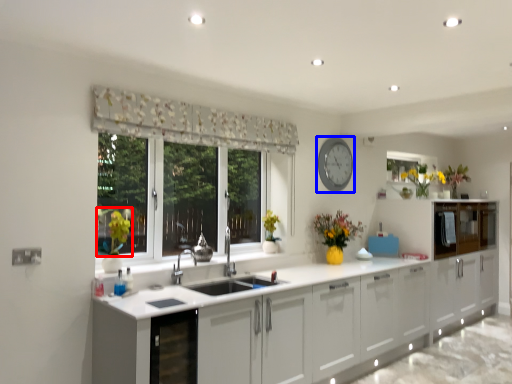
Question: Among these objects, which one is farthest to the camera, plant (highlighted by a red box) or clock (highlighted by a blue box)?

Choices:
 (A) plant
 (B) clock

Answer: (B)